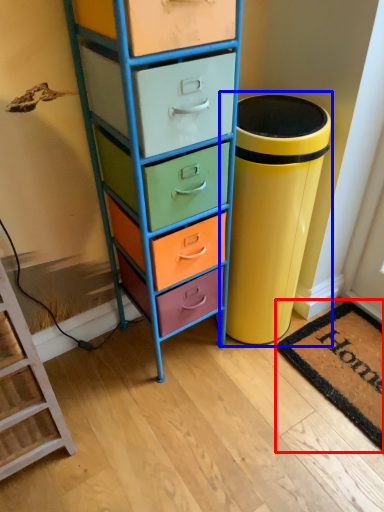
Question: Which point is further to the camera, mat (highlighted by a red box) or waste container (highlighted by a blue box)?

Choices:
 (A) mat
 (B) waste container

Answer: (A)